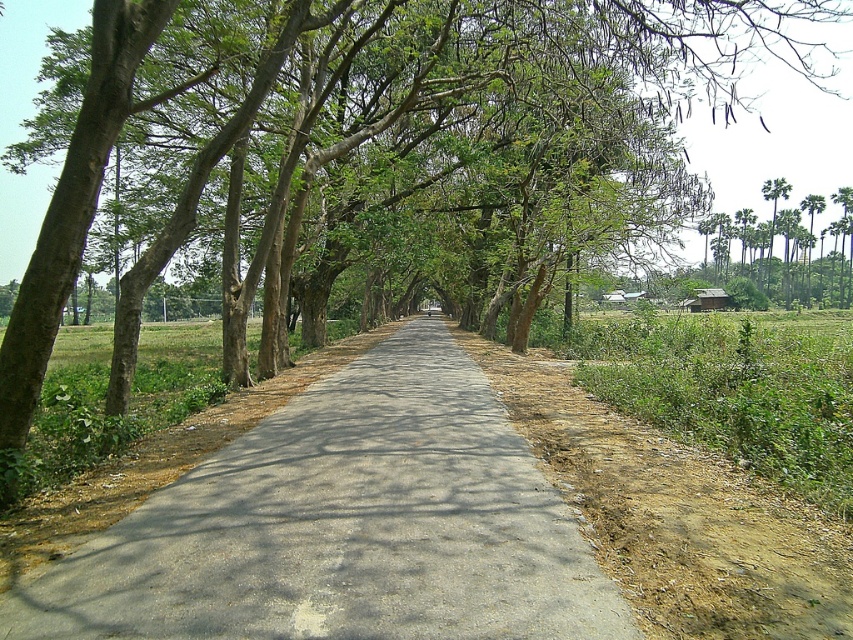
Question: Does gray concrete road at center have a larger size compared to brown dirt track at right?

Choices:
 (A) yes
 (B) no

Answer: (B)

Question: Which object is positioned farthest from the gray concrete road at center?

Choices:
 (A) green leafy palm trees at right
 (B) brown dirt track at right

Answer: (A)

Question: Considering the real-world distances, which object is farthest from the brown dirt track at right?

Choices:
 (A) green leafy palm trees at right
 (B) gray concrete road at center

Answer: (A)

Question: Can you confirm if gray concrete road at center is positioned to the right of brown dirt track at right?

Choices:
 (A) no
 (B) yes

Answer: (A)

Question: Can you confirm if brown dirt track at right is positioned below green leafy palm trees at right?

Choices:
 (A) yes
 (B) no

Answer: (A)

Question: Which point appears farthest from the camera in this image?

Choices:
 (A) (564, 451)
 (B) (848, 301)
 (C) (158, 573)

Answer: (B)